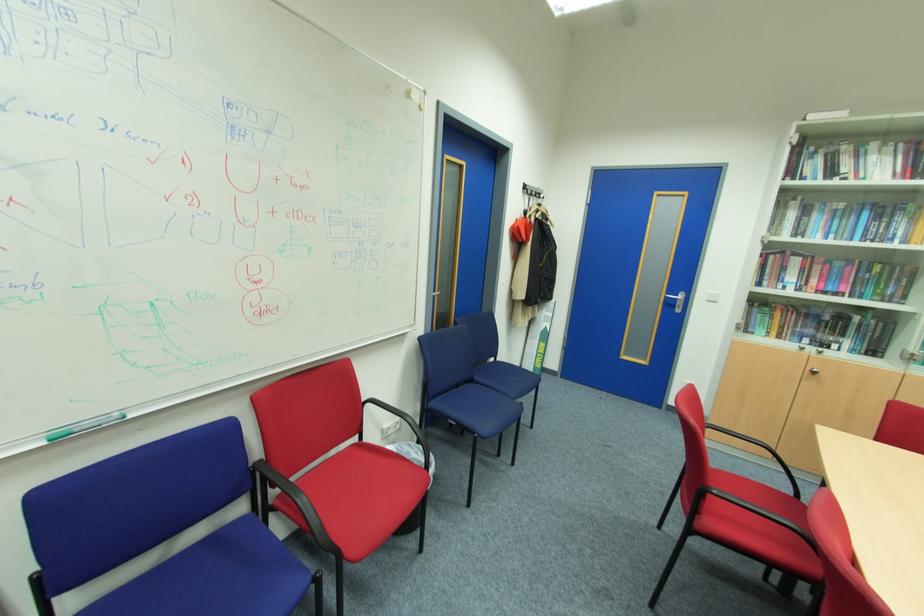
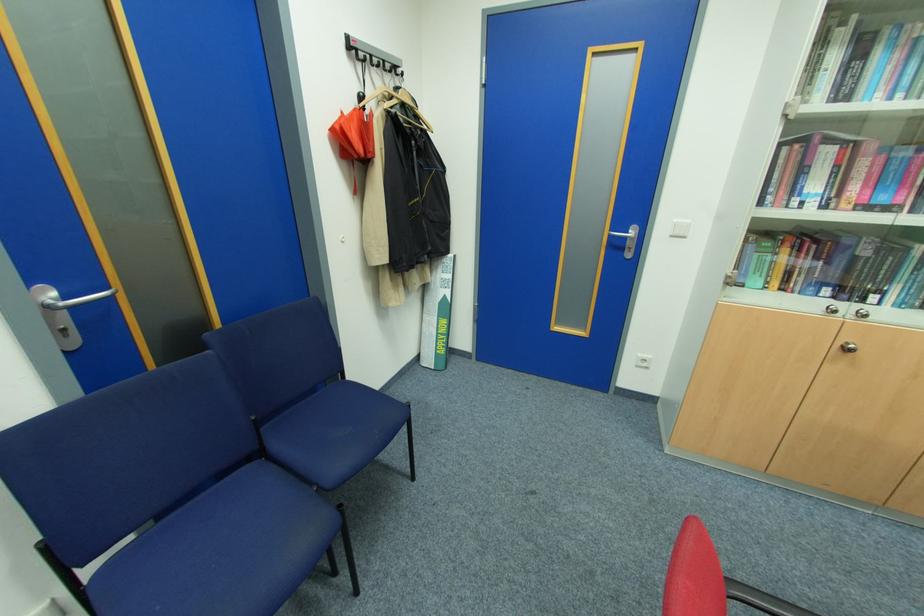
The point at (x=538, y=192) is marked in the first image. Where is the corresponding point in the second image?

(380, 60)